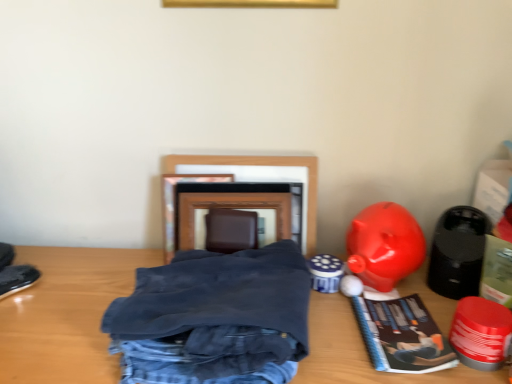
This screenshot has width=512, height=384. In order to click on free space above wooden table at center (from a real-world perspective) in this screenshot , I will do `click(146, 263)`.